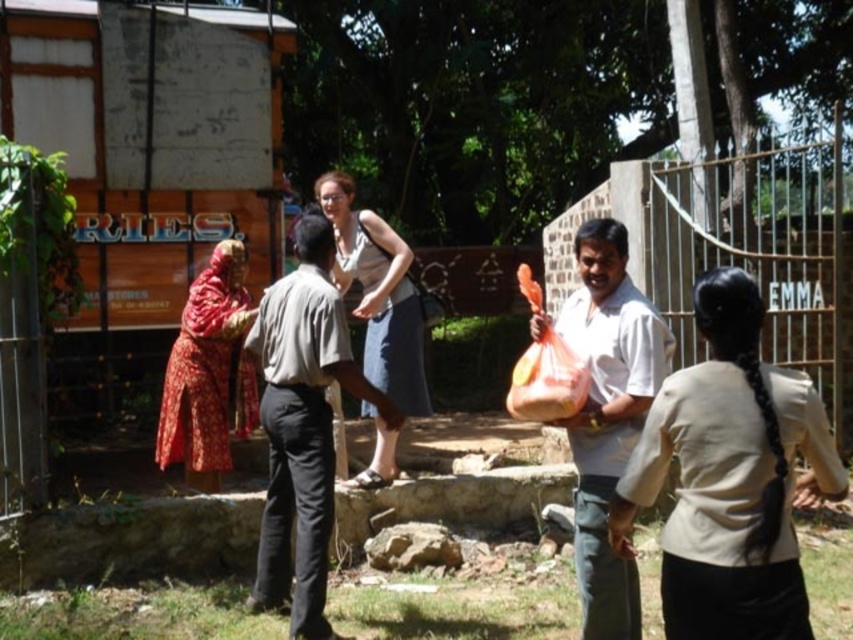
Question: Can you confirm if light brown cotton shirt at center is positioned to the right of red floral fabric at left?

Choices:
 (A) no
 (B) yes

Answer: (B)

Question: Which point is farther to the camera?

Choices:
 (A) (329, 477)
 (B) (527, 352)
 (C) (582, 428)

Answer: (A)

Question: Among these points, which one is farthest from the camera?

Choices:
 (A) (231, 403)
 (B) (361, 304)
 (C) (567, 387)

Answer: (A)

Question: Is red floral fabric at left bigger than denim skirt at center?

Choices:
 (A) no
 (B) yes

Answer: (A)

Question: Can you confirm if beige fabric shirt at center is positioned to the left of denim skirt at center?

Choices:
 (A) yes
 (B) no

Answer: (B)

Question: Which object appears farthest from the camera in this image?

Choices:
 (A) denim skirt at center
 (B) translucent orange bag at right
 (C) red floral fabric at left
 (D) white matte shirt at center

Answer: (C)